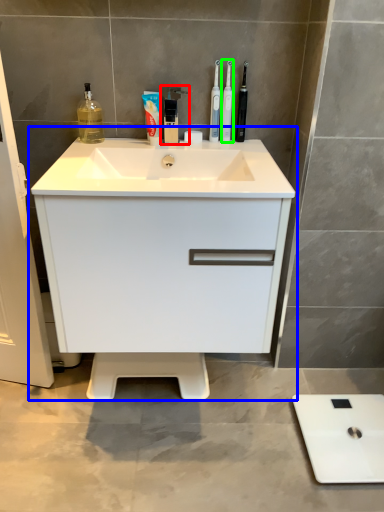
Question: Which object is positioned farthest from faucet (highlighted by a red box)? Select from bathroom cabinet (highlighted by a blue box) and toothbrush (highlighted by a green box).

Choices:
 (A) bathroom cabinet
 (B) toothbrush

Answer: (A)